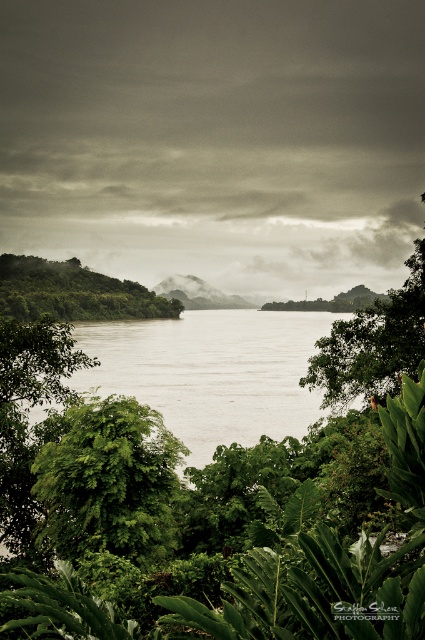
You are standing at the edge of the river and want to walk towards the two points marked in the image. Which point, point (x=246, y=385) or point (x=44, y=476), will you reach first?

You will reach point (x=246, y=385) first because it is closer to you than point (x=44, y=476), which is further away.